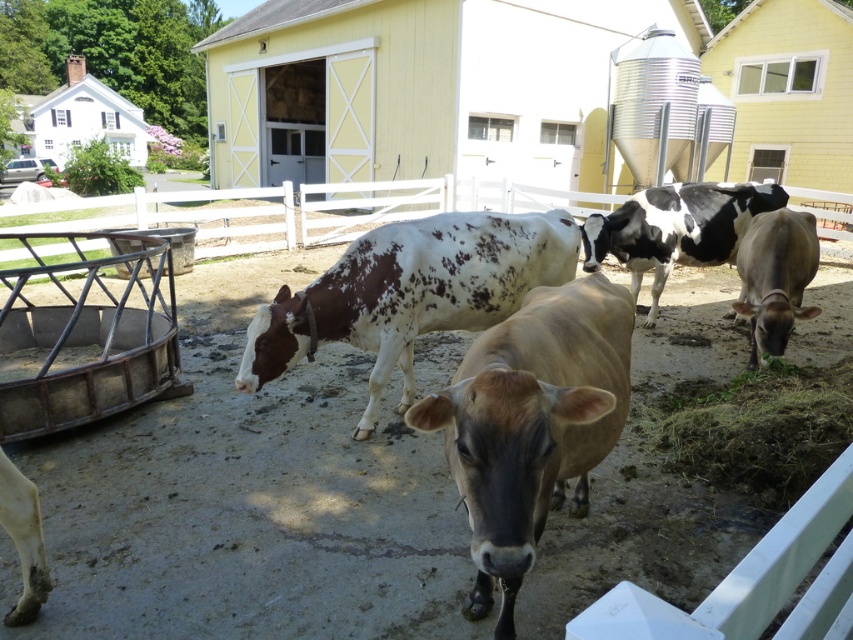
Can you confirm if speckled white cow at center is positioned above white painted wood barn at upper left?

No, speckled white cow at center is not above white painted wood barn at upper left.

Is speckled white cow at center thinner than white painted wood barn at upper left?

Yes.

Is point (515, 253) positioned after point (126, 112)?

No, (515, 253) is closer to viewer.

Locate an element on the screen. speckled white cow at center is located at coordinates (410, 292).

What do you see at coordinates (531, 422) in the screenshot?
I see `brown glossy cow at center` at bounding box center [531, 422].

Is point (466, 497) farther from camera compared to point (651, 256)?

That is False.

At what (x,y) coordinates should I click in order to perform the action: click on brown glossy cow at center. Please return your answer as a coordinate pair (x, y). Looking at the image, I should click on (531, 422).

Does point (477, 218) come in front of point (738, 189)?

That is True.

Locate an element on the screen. The width and height of the screenshot is (853, 640). speckled white cow at center is located at coordinates (410, 292).